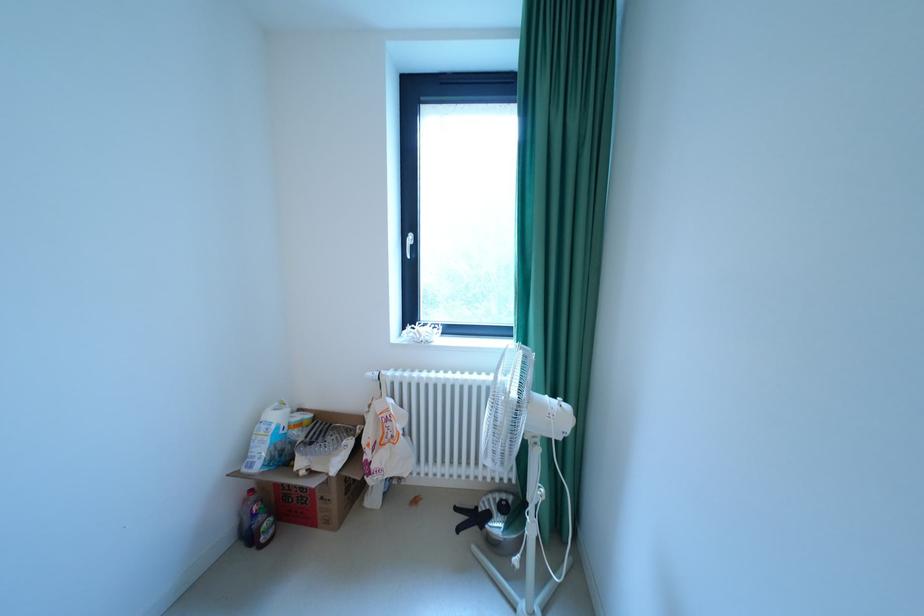
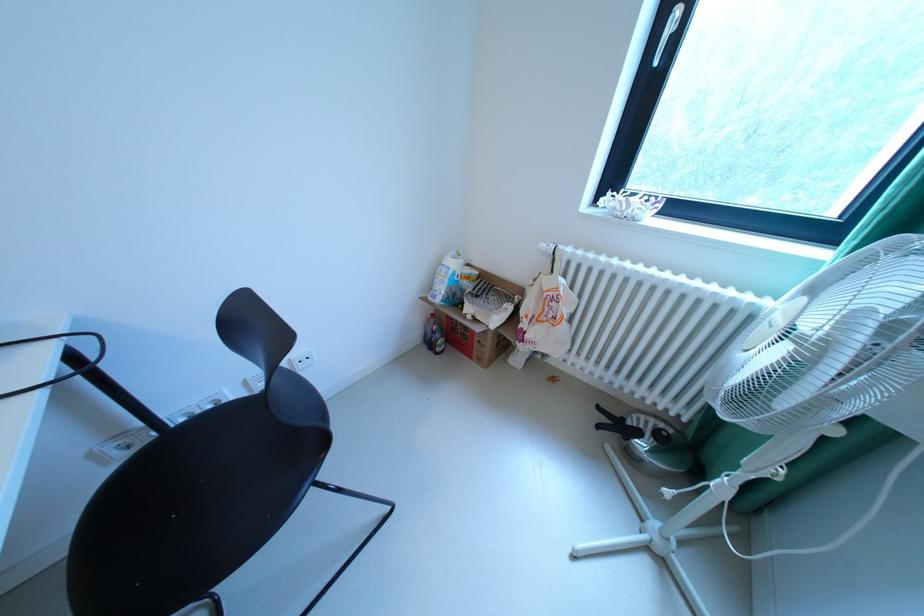
Find the pixel in the second image that matches [380,375] in the first image.

(553, 246)